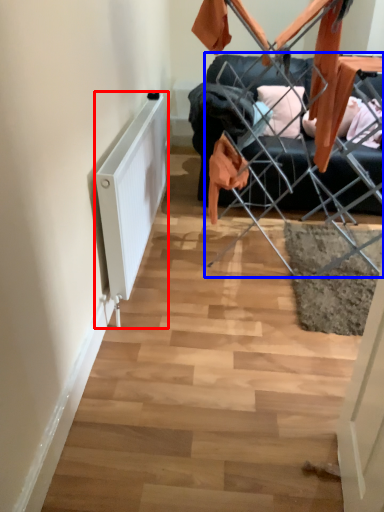
Question: Which of the following is the closest to the observer, radiator (highlighted by a red box) or furniture (highlighted by a blue box)?

Choices:
 (A) radiator
 (B) furniture

Answer: (A)